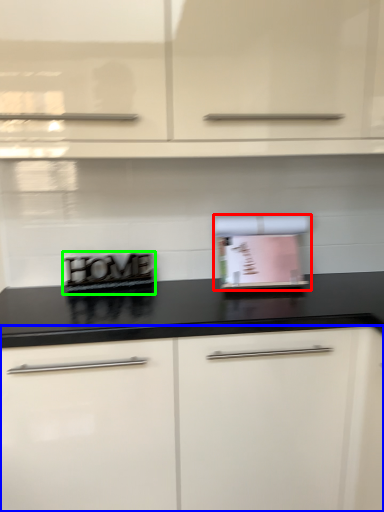
Question: Considering the real-world distances, which object is closest to appliance (highlighted by a red box)? cabinetry (highlighted by a blue box) or appliance (highlighted by a green box).

Choices:
 (A) cabinetry
 (B) appliance

Answer: (B)